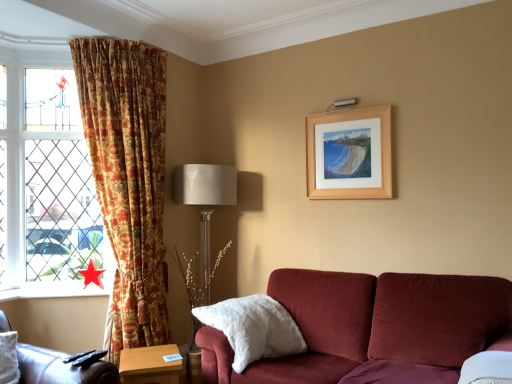
Question: Is white fluffy pillow at lower center facing towards satin beige lampshade at center?

Choices:
 (A) yes
 (B) no

Answer: (B)

Question: Is white fluffy pillow at lower center in contact with satin beige lampshade at center?

Choices:
 (A) yes
 (B) no

Answer: (B)

Question: Can you confirm if white fluffy pillow at lower center is positioned to the right of satin beige lampshade at center?

Choices:
 (A) yes
 (B) no

Answer: (A)

Question: From a real-world perspective, is white fluffy pillow at lower center below satin beige lampshade at center?

Choices:
 (A) yes
 (B) no

Answer: (A)

Question: Is white fluffy pillow at lower center turned away from satin beige lampshade at center?

Choices:
 (A) no
 (B) yes

Answer: (B)

Question: From the image's perspective, is white fluffy pillow at lower center located above satin beige lampshade at center?

Choices:
 (A) no
 (B) yes

Answer: (A)

Question: From a real-world perspective, is satin beige lampshade at center below floral fabric curtain at left?

Choices:
 (A) yes
 (B) no

Answer: (A)

Question: Can you confirm if satin beige lampshade at center is taller than floral fabric curtain at left?

Choices:
 (A) no
 (B) yes

Answer: (A)

Question: Is satin beige lampshade at center facing away from floral fabric curtain at left?

Choices:
 (A) no
 (B) yes

Answer: (A)

Question: Does satin beige lampshade at center have a lesser width compared to floral fabric curtain at left?

Choices:
 (A) no
 (B) yes

Answer: (B)

Question: Is satin beige lampshade at center to the right of floral fabric curtain at left from the viewer's perspective?

Choices:
 (A) yes
 (B) no

Answer: (A)

Question: From the image's perspective, does satin beige lampshade at center appear lower than floral fabric curtain at left?

Choices:
 (A) no
 (B) yes

Answer: (B)

Question: Is leather at left placed right next to red paper star at lower left?

Choices:
 (A) yes
 (B) no

Answer: (B)